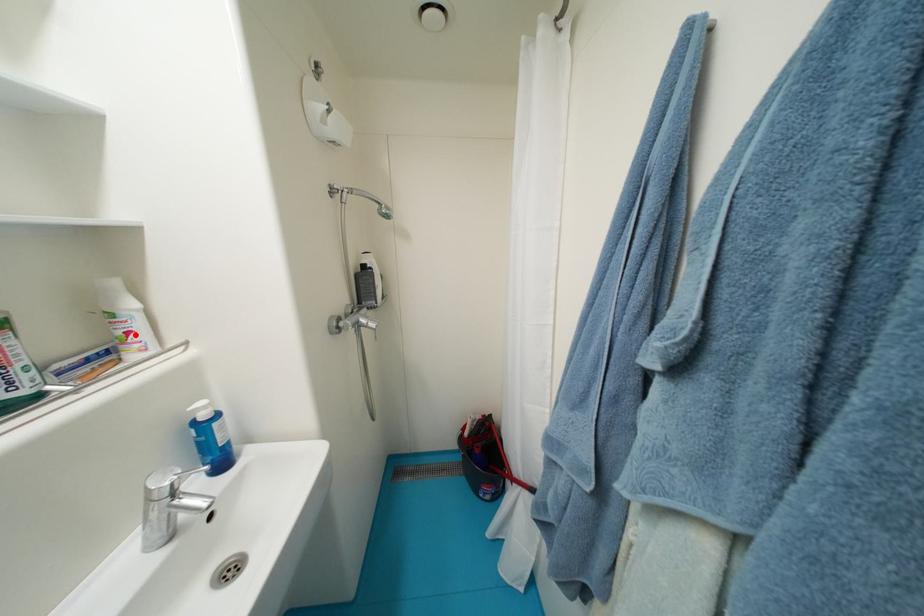
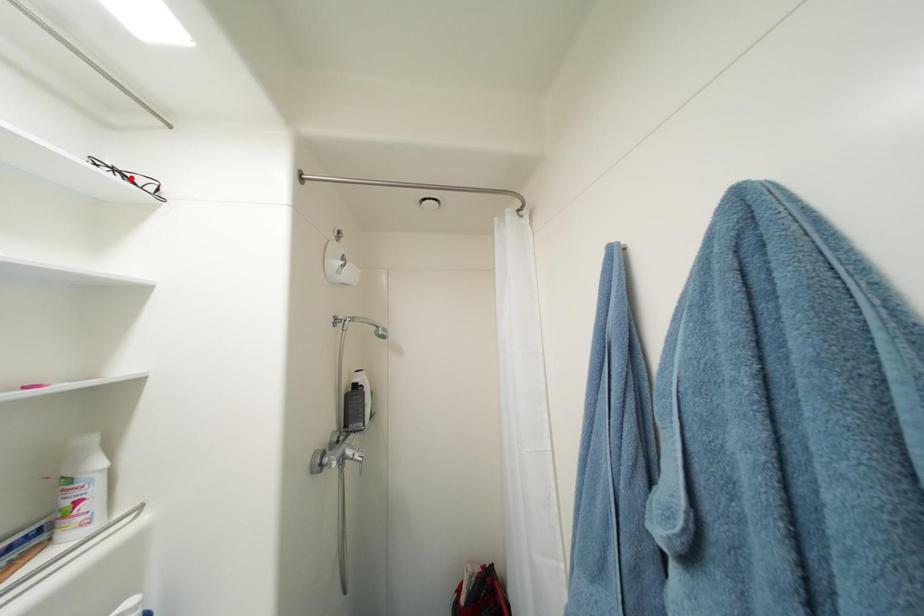
I am providing you with two images of the same scene from different viewpoints. A red point is marked on the first image and another point is marked on the second image. Does the point marked in image1 correspond to the same location as the one in image2?

No